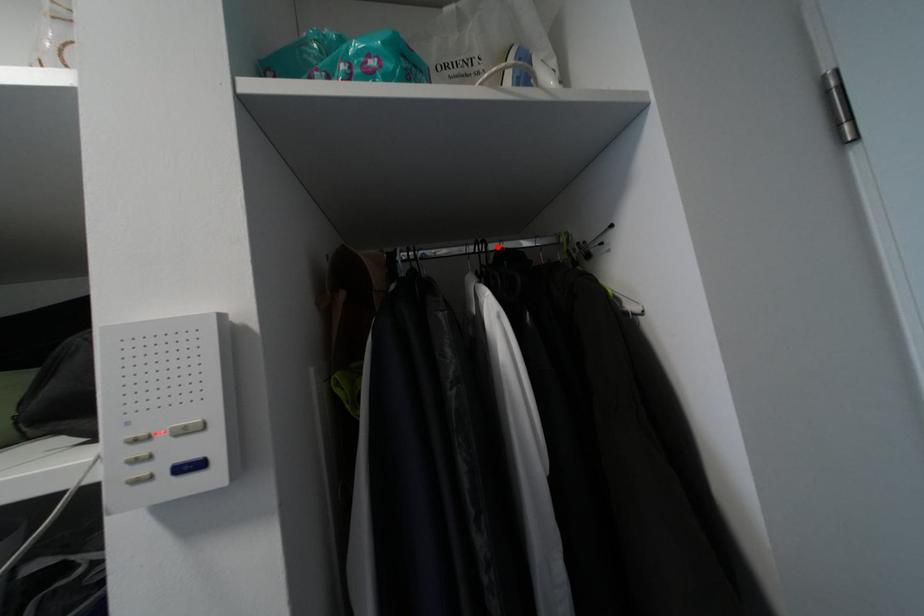
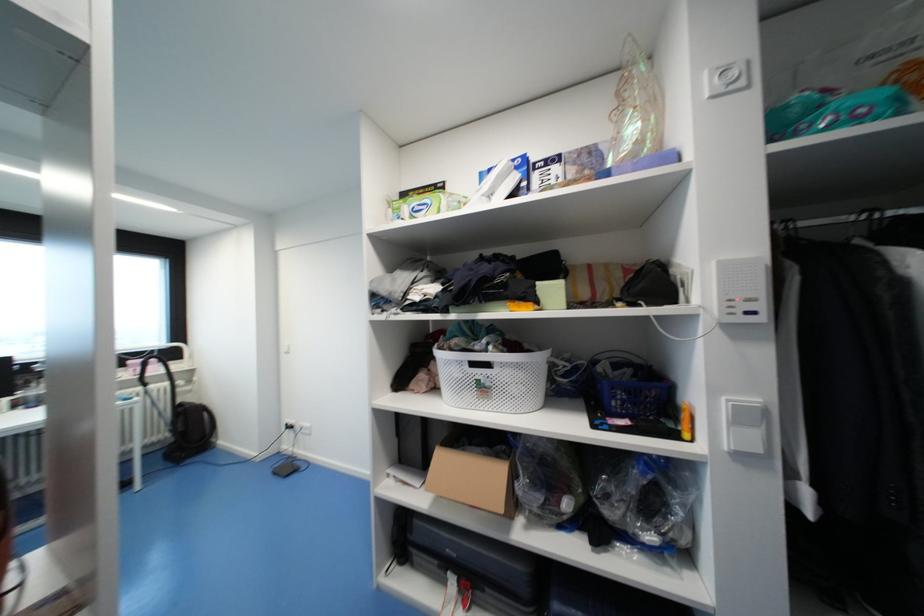
Locate, in the second image, the point that corresponds to the highlighted location in the first image.

(895, 214)